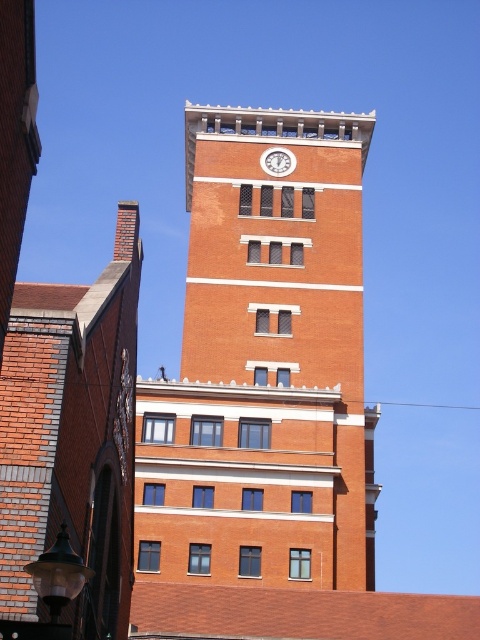
Question: Is brick clock tower at center below white glossy clock at upper center?

Choices:
 (A) no
 (B) yes

Answer: (B)

Question: Among these objects, which one is nearest to the camera?

Choices:
 (A) brick clock tower at center
 (B) white glossy clock at upper center

Answer: (A)

Question: Does brick clock tower at center appear on the right side of white glossy clock at upper center?

Choices:
 (A) yes
 (B) no

Answer: (B)

Question: Where is brick clock tower at center located in relation to white glossy clock at upper center in the image?

Choices:
 (A) right
 (B) left

Answer: (B)

Question: Among these points, which one is farthest from the camera?

Choices:
 (A) (282, 163)
 (B) (213, 147)

Answer: (B)